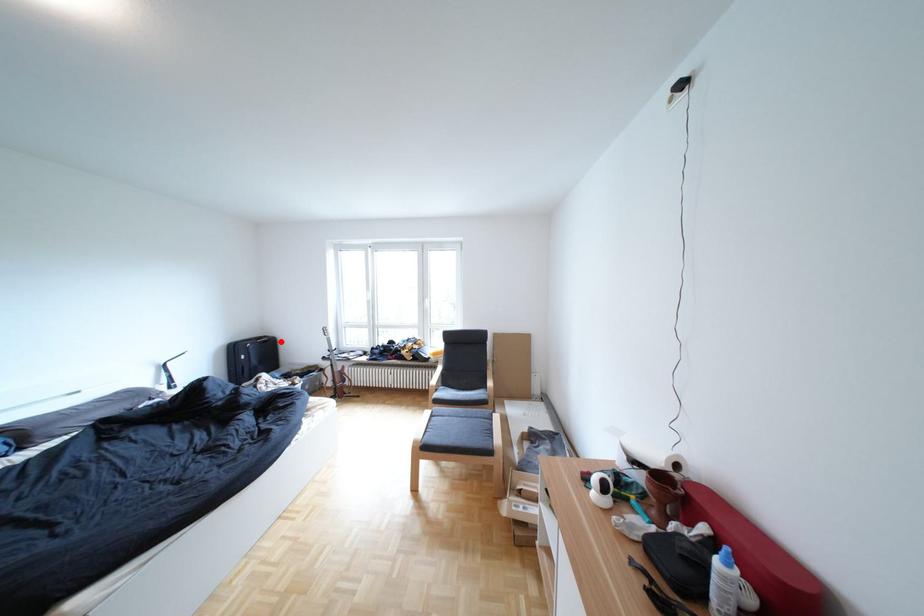
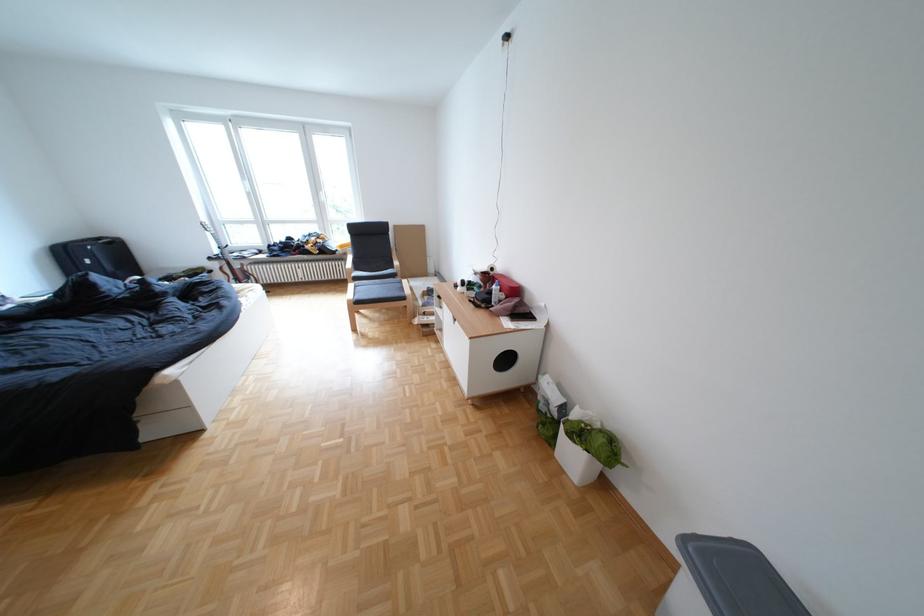
Question: I am providing you with two images of the same scene from different viewpoints. In image1, a red point is highlighted. Considering the same 3D point in image2, which of the following is correct?

Choices:
 (A) It is closer
 (B) It is farther

Answer: (B)